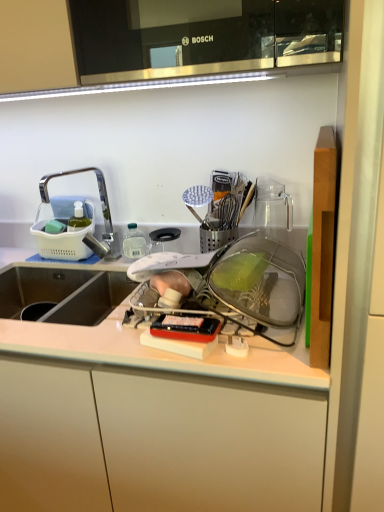
Question: From the image's perspective, would you say brushed metal faucet at left is positioned over white plastic tray at center?

Choices:
 (A) yes
 (B) no

Answer: (A)

Question: Is white plastic tray at center a part of brushed metal faucet at left?

Choices:
 (A) no
 (B) yes

Answer: (A)

Question: Is white plastic tray at center at the back of brushed metal faucet at left?

Choices:
 (A) yes
 (B) no

Answer: (B)

Question: Does brushed metal faucet at left come behind white plastic tray at center?

Choices:
 (A) no
 (B) yes

Answer: (B)

Question: From a real-world perspective, is brushed metal faucet at left on top of white plastic tray at center?

Choices:
 (A) no
 (B) yes

Answer: (B)

Question: Looking at the image, does brushed metal faucet at left seem bigger or smaller compared to white matte cabinet at center?

Choices:
 (A) small
 (B) big

Answer: (A)

Question: Is brushed metal faucet at left in front of or behind white matte cabinet at center in the image?

Choices:
 (A) front
 (B) behind

Answer: (B)

Question: Would you say brushed metal faucet at left is inside or outside white matte cabinet at center?

Choices:
 (A) outside
 (B) inside

Answer: (A)

Question: Is brushed metal faucet at left wider or thinner than white matte cabinet at center?

Choices:
 (A) thin
 (B) wide

Answer: (A)

Question: From the image's perspective, relative to white plastic tray at center, is brushed metal faucet at left above or below?

Choices:
 (A) below
 (B) above

Answer: (B)

Question: Is point (48, 179) closer or farther from the camera than point (273, 351)?

Choices:
 (A) farther
 (B) closer

Answer: (A)

Question: Is brushed metal faucet at left to the left or to the right of white plastic tray at center in the image?

Choices:
 (A) left
 (B) right

Answer: (A)

Question: Is brushed metal faucet at left in front of or behind white plastic tray at center in the image?

Choices:
 (A) front
 (B) behind

Answer: (B)

Question: Based on their positions, is white plastic tray at center located to the left or right of white matte cabinet at center?

Choices:
 (A) right
 (B) left

Answer: (A)

Question: Is point (223, 374) positioned closer to the camera than point (294, 492)?

Choices:
 (A) farther
 (B) closer

Answer: (B)